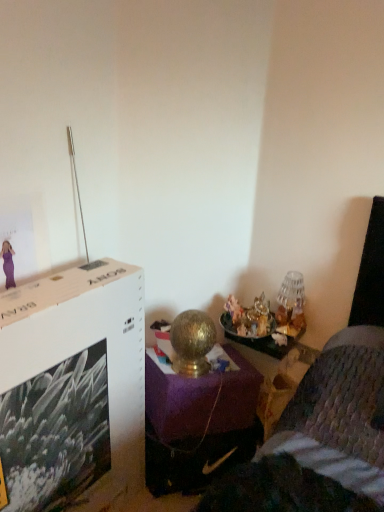
Describe the element at coordinates (263, 341) in the screenshot. Image resolution: width=384 pixels, height=512 pixels. I see `gold metallic table at center` at that location.

Locate an element on the screen. white cardboard file cabinet at upper left is located at coordinates (73, 388).

Image resolution: width=384 pixels, height=512 pixels. What do you see at coordinates (291, 304) in the screenshot?
I see `gold metallic table lamp at right` at bounding box center [291, 304].

The height and width of the screenshot is (512, 384). I want to click on gold metallic table at center, so click(263, 341).

Considering the sizes of gold metallic table lamp at right and white cardboard file cabinet at upper left in the image, is gold metallic table lamp at right wider or thinner than white cardboard file cabinet at upper left?

Clearly, gold metallic table lamp at right has less width compared to white cardboard file cabinet at upper left.

Looking at this image, is gold metallic table lamp at right further to the viewer compared to white cardboard file cabinet at upper left?

Yes, it is.

Is gold metallic table lamp at right completely or partially outside of white cardboard file cabinet at upper left?

Absolutely, gold metallic table lamp at right is external to white cardboard file cabinet at upper left.

How different are the orientations of gold metallic table lamp at right and white cardboard file cabinet at upper left in degrees?

90.2 degrees.

Considering the positions of objects gold metallic table at center and gold metallic table lamp at right in the image provided, who is more to the right, gold metallic table at center or gold metallic table lamp at right?

From the viewer's perspective, gold metallic table lamp at right appears more on the right side.

Is gold metallic table at center in contact with gold metallic table lamp at right?

They are not placed beside each other.

Which object is further away from the camera, gold metallic table at center or gold metallic table lamp at right?

Positioned behind is gold metallic table lamp at right.

Which of these two, white cardboard file cabinet at upper left or gold metallic table lamp at right, is smaller?

gold metallic table lamp at right.

Which object is wider, white cardboard file cabinet at upper left or gold metallic table lamp at right?

With larger width is white cardboard file cabinet at upper left.

Which is in front, point (138, 431) or point (288, 320)?

Point (138, 431)

Looking at this image, are white cardboard file cabinet at upper left and gold metallic table lamp at right far apart?

No, white cardboard file cabinet at upper left is not far away from gold metallic table lamp at right.

Which of these two, gold metallic table lamp at right or gold metallic table at center, is bigger?

Bigger between the two is gold metallic table at center.

From a real-world perspective, is gold metallic table lamp at right positioned above or below gold metallic table at center?

gold metallic table lamp at right is above gold metallic table at center.

Relative to gold metallic table at center, is gold metallic table lamp at right in front or behind?

Clearly, gold metallic table lamp at right is behind gold metallic table at center.

Considering the relative positions of gold metallic table lamp at right and gold metallic table at center in the image provided, is gold metallic table lamp at right to the left of gold metallic table at center from the viewer's perspective?

No, gold metallic table lamp at right is not to the left of gold metallic table at center.

Measure the distance between white cardboard file cabinet at upper left and gold metallic table at center.

white cardboard file cabinet at upper left is 28.25 inches from gold metallic table at center.

Does point (118, 290) lie in front of point (269, 344)?

Yes, point (118, 290) is closer to viewer.

Is white cardboard file cabinet at upper left at the right side of gold metallic table at center?

Incorrect, white cardboard file cabinet at upper left is not on the right side of gold metallic table at center.

Is white cardboard file cabinet at upper left outside of gold metallic table at center?

Yes, white cardboard file cabinet at upper left is located beyond the bounds of gold metallic table at center.

Looking at this image, considering the relative sizes of gold metallic table at center and white cardboard file cabinet at upper left in the image provided, is gold metallic table at center shorter than white cardboard file cabinet at upper left?

Yes, gold metallic table at center is shorter than white cardboard file cabinet at upper left.

From the image's perspective, is gold metallic table at center below white cardboard file cabinet at upper left?

No, from the image's perspective, gold metallic table at center is not below white cardboard file cabinet at upper left.

Looking at their sizes, would you say gold metallic table at center is wider or thinner than white cardboard file cabinet at upper left?

In the image, gold metallic table at center appears to be wider than white cardboard file cabinet at upper left.

Find the location of a particular element. This screenshot has width=384, height=512. file cabinet below the gold metallic table lamp at right (from a real-world perspective) is located at coordinates (73, 388).

This screenshot has height=512, width=384. What are the coordinates of `table lamp that appears on the right of gold metallic table at center` in the screenshot? It's located at (291, 304).

When comparing their distances from gold metallic table lamp at right, does white cardboard file cabinet at upper left or gold metallic table at center seem closer?

gold metallic table at center is positioned closer to the anchor gold metallic table lamp at right.

From the image, which object appears to be nearer to gold metallic table lamp at right, gold metallic table at center or white cardboard file cabinet at upper left?

gold metallic table at center is positioned closer to the anchor gold metallic table lamp at right.

From the image, which object appears to be farther from white cardboard file cabinet at upper left, gold metallic table at center or gold metallic table lamp at right?

gold metallic table lamp at right is positioned further to the anchor white cardboard file cabinet at upper left.

When comparing their distances from white cardboard file cabinet at upper left, does gold metallic table lamp at right or gold metallic table at center seem closer?

gold metallic table at center lies closer to white cardboard file cabinet at upper left than the other object.

Which object lies nearer to the anchor point gold metallic table at center, white cardboard file cabinet at upper left or gold metallic table lamp at right?

gold metallic table lamp at right is closer to gold metallic table at center.

From the image, which object appears to be farther from gold metallic table at center, gold metallic table lamp at right or white cardboard file cabinet at upper left?

white cardboard file cabinet at upper left.

Where is `table between white cardboard file cabinet at upper left and gold metallic table lamp at right from left to right`? Image resolution: width=384 pixels, height=512 pixels. table between white cardboard file cabinet at upper left and gold metallic table lamp at right from left to right is located at coordinates pos(263,341).